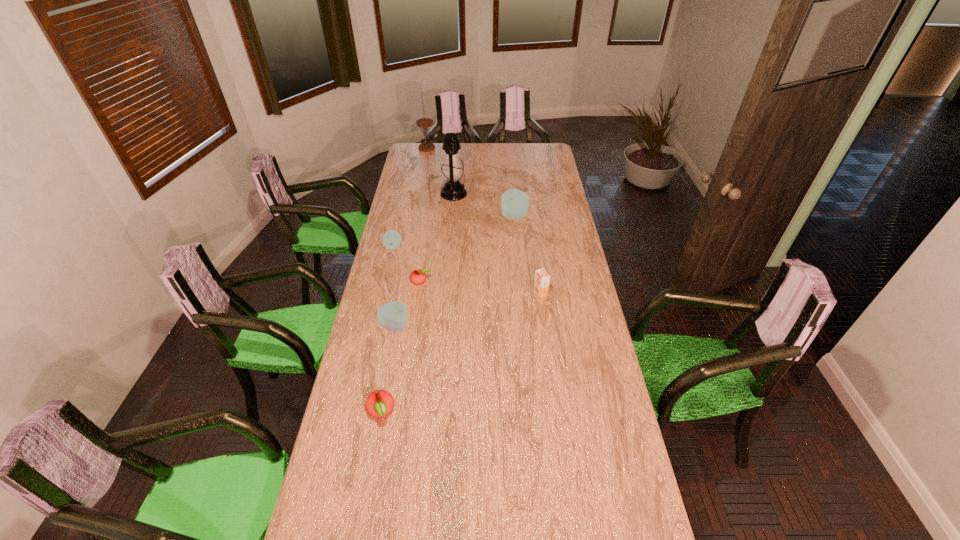
The height and width of the screenshot is (540, 960). I want to click on oil lamp, so click(x=452, y=170).

Where is `the seventh nearest object`? Image resolution: width=960 pixels, height=540 pixels. the seventh nearest object is located at coordinates (452, 170).

The image size is (960, 540). I want to click on hourglass, so click(424, 123).

Identify the location of the rightmost white apple. Image resolution: width=960 pixels, height=540 pixels. (515, 203).

The width and height of the screenshot is (960, 540). I want to click on the third farthest object, so click(515, 203).

Where is `the second tallest apple`? The image size is (960, 540). the second tallest apple is located at coordinates (392, 316).

What are the coordinates of `the nearest white apple` in the screenshot? It's located at (392, 316).

Locate an element on the screen. Image resolution: width=960 pixels, height=540 pixels. the third nearest object is located at coordinates (541, 283).

Identify the location of orange juice. (541, 283).

This screenshot has height=540, width=960. What are the coordinates of `the smallest white apple` in the screenshot? It's located at (391, 239).